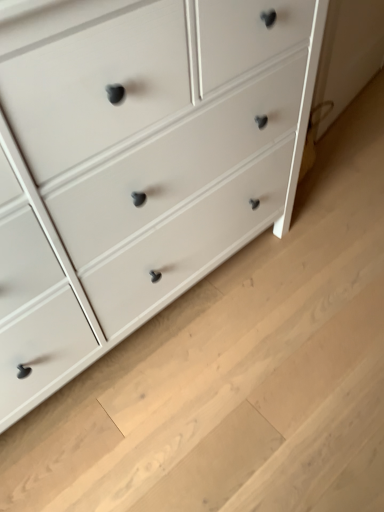
Where is `free space to the right of white painted wood chest of drawers at center`? The height and width of the screenshot is (512, 384). free space to the right of white painted wood chest of drawers at center is located at coordinates (315, 269).